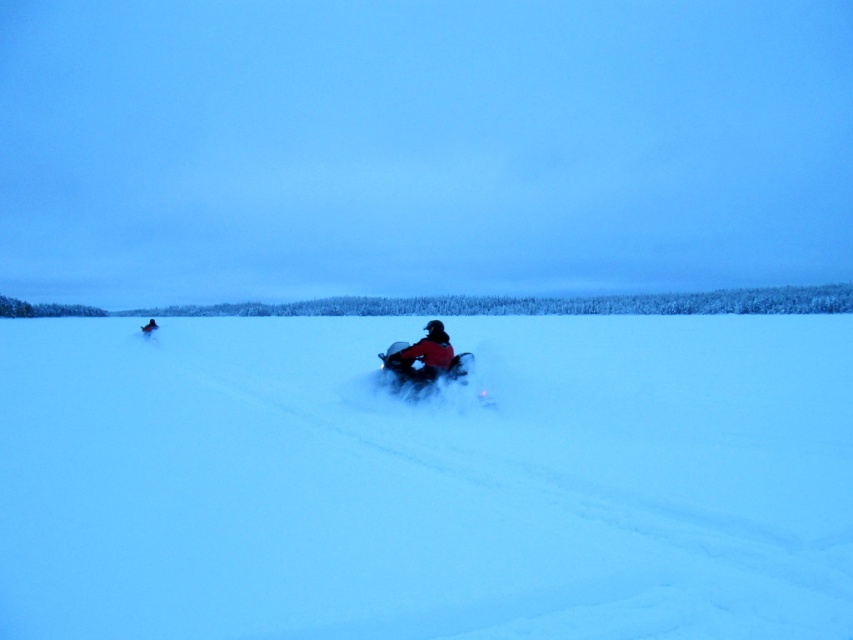
You are standing in the winter scene and want to place a small flag at the point closer to you between the two points marked as point (451,369) and point (422,369). Which point should you choose?

You should choose point (451,369) because it is closer to the viewer than point (422,369).

You are planning to build a snowman using the white powdery snow at center. According to the coordinates given, where exactly should you go to collect the snow?

The white powdery snow at center is located at coordinates point (426, 481), so you should go there to collect the snow.

Consider the image. You are a drone operator trying to capture aerial footage of the shiny metallic snowmobile at center in the winter scene. The drone is currently hovering at the center of the image. Based on the coordinates provided, will you need to move the drone left or right to frame the snowmobile properly?

The shiny metallic snowmobile at center is located at coordinates point (x=422, y=369). Since the drone is at the center, which is typically at coordinate point (x=426, y=320), you need to move the drone slightly to the right to align with the snowmobile.